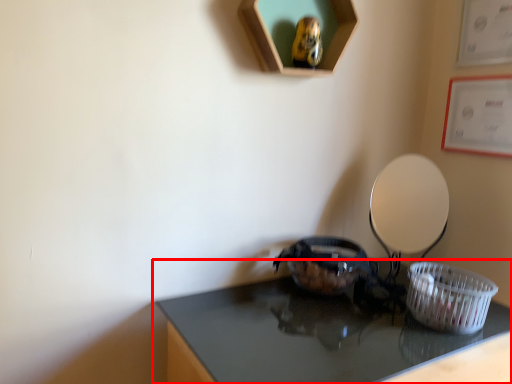
Question: Observing the image, what is the correct spatial positioning of table (annotated by the red box) in reference to basket?

Choices:
 (A) left
 (B) right

Answer: (A)